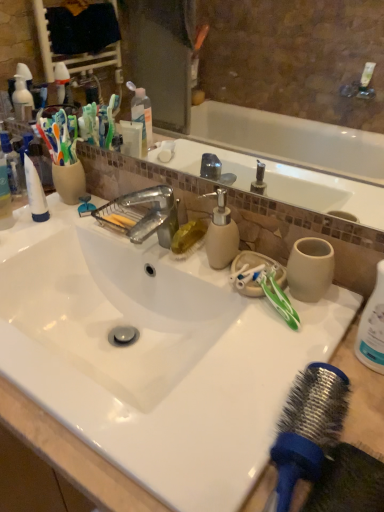
You are a GUI agent. You are given a task and a screenshot of the screen. Output one action in this format:
    pyautogui.click(x=<x>, y=<y>)
    Task: Click on the vacant space to the left of blue rubber hair brush at lower right
    This screenshot has height=512, width=384.
    Given the screenshot: What is the action you would take?
    pyautogui.click(x=168, y=463)